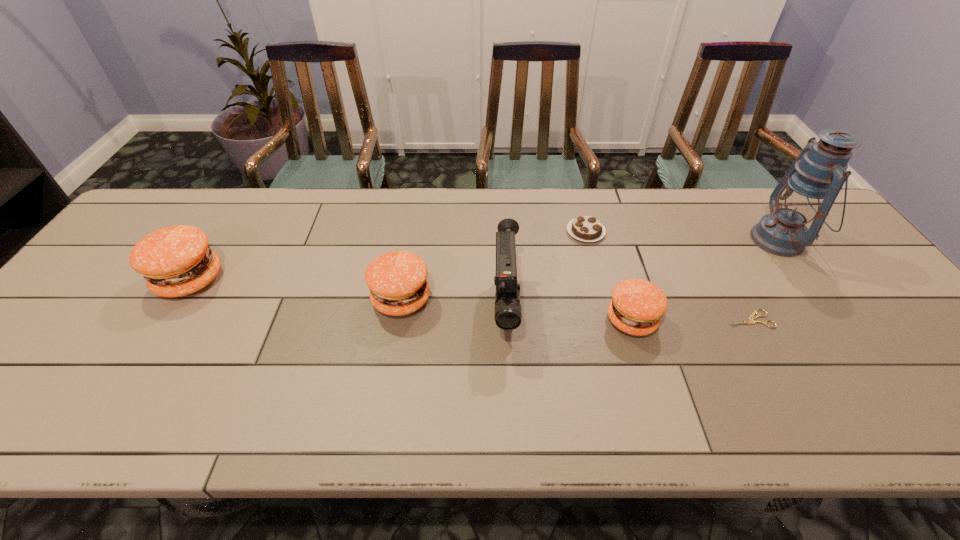
At what (x,y) coordinates should I click in order to perform the action: click on camcorder. Please return your answer as a coordinate pair (x, y). This screenshot has height=540, width=960. Looking at the image, I should click on (508, 316).

Where is `the sixth shortest object`? The image size is (960, 540). the sixth shortest object is located at coordinates (508, 316).

Where is `free space located on the left of the leftmost object`? free space located on the left of the leftmost object is located at coordinates (84, 280).

At what (x,y) coordinates should I click in order to perform the action: click on free point located 0.400m on the left of the second object from left to right. Please return your answer as a coordinate pair (x, y). Looking at the image, I should click on (214, 299).

The width and height of the screenshot is (960, 540). I want to click on blank space located on the back of the shortest patty, so point(613,260).

In order to click on free space located on the back of the second shortest object in this screenshot , I will do `click(576, 193)`.

You are a GUI agent. You are given a task and a screenshot of the screen. Output one action in this format:
    pyautogui.click(x=<x>, y=<y>)
    Task: Click on the vacant space located 0.320m on the front-facing side of the tallest object
    
    Given the screenshot: What is the action you would take?
    pyautogui.click(x=641, y=240)

The height and width of the screenshot is (540, 960). What are the coordinates of `vacant area situated 0.390m on the front-facing side of the tallest object` in the screenshot? It's located at (617, 240).

This screenshot has height=540, width=960. Identify the location of free space located on the front-facing side of the tallest object. (734, 240).

Image resolution: width=960 pixels, height=540 pixels. Identify the location of vacant space located on the back of the shortest object. (713, 252).